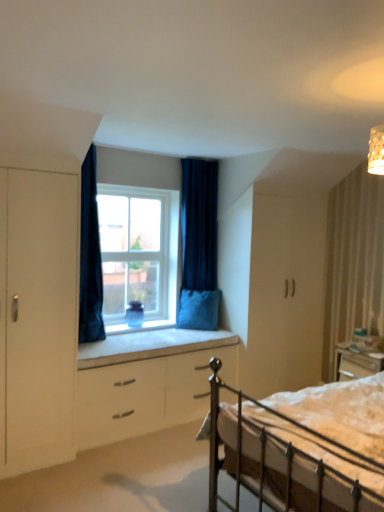
Where is `vacant space situated above white matte cabinet at left (from a real-world perspective)`? The width and height of the screenshot is (384, 512). vacant space situated above white matte cabinet at left (from a real-world perspective) is located at coordinates (46, 167).